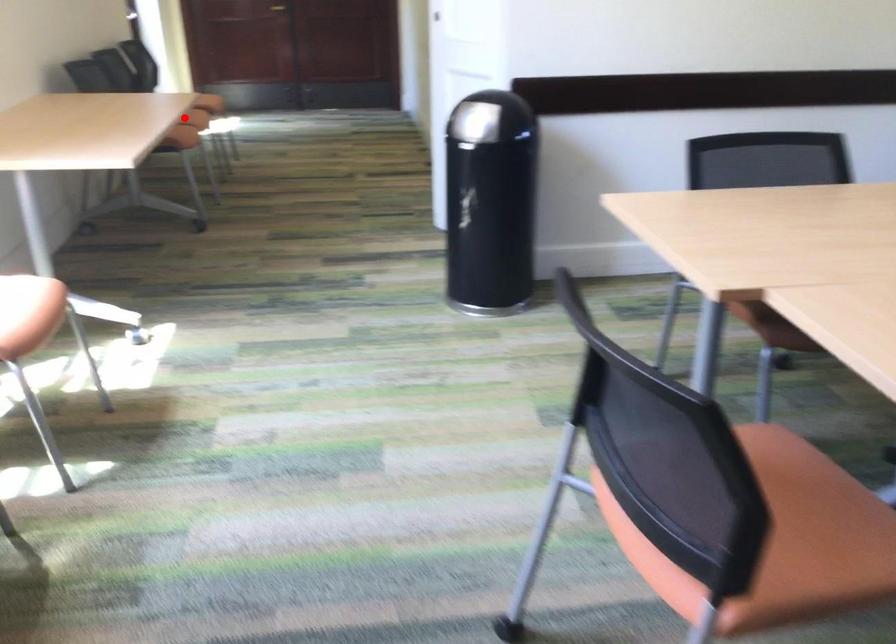
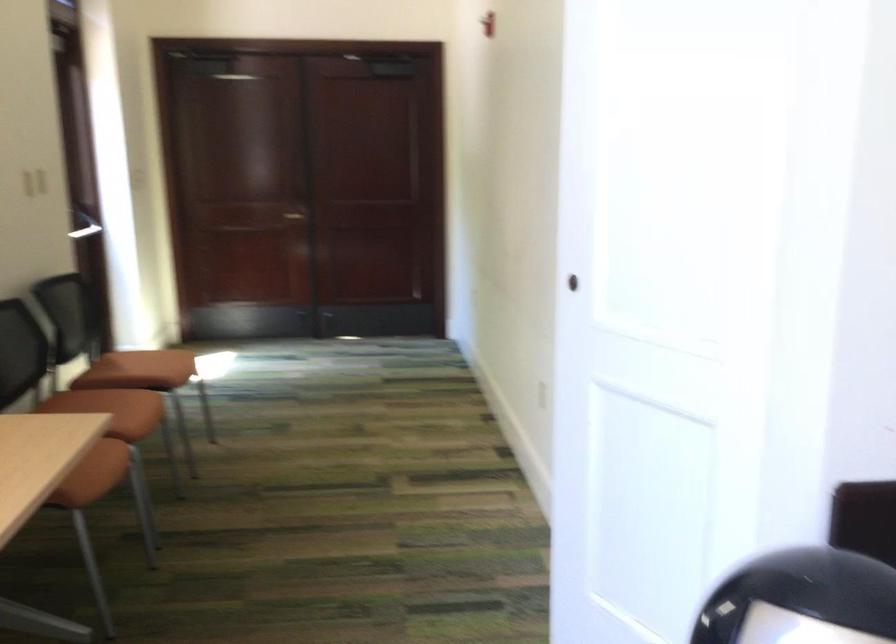
Question: I am providing you with two images of the same scene from different viewpoints. A red point is shown in image1. For the corresponding object point in image2, is it positioned nearer or farther from the camera?

Choices:
 (A) Nearer
 (B) Farther

Answer: (A)